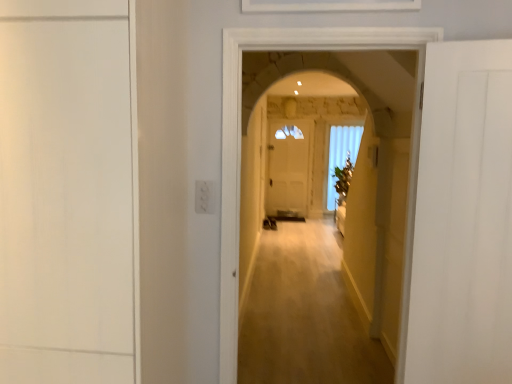
Question: Is wooden floor at center in front of or behind white matte door at right, the second door from the left, in the image?

Choices:
 (A) behind
 (B) front

Answer: (A)

Question: From the image's perspective, is wooden floor at center positioned above or below white matte door at right, acting as the 1th door starting from the right?

Choices:
 (A) below
 (B) above

Answer: (A)

Question: Considering the real-world distances, which object is closest to the white glass window at center?

Choices:
 (A) wooden floor at center
 (B) white matte door at left, the 1th door from the left
 (C) white matte door at right, acting as the 1th door starting from the right

Answer: (A)

Question: Estimate the real-world distances between objects in this image. Which object is closer to the white matte door at right, acting as the 1th door starting from the right?

Choices:
 (A) white matte door at left, acting as the second door starting from the right
 (B) white glass window at center
 (C) wooden floor at center

Answer: (C)